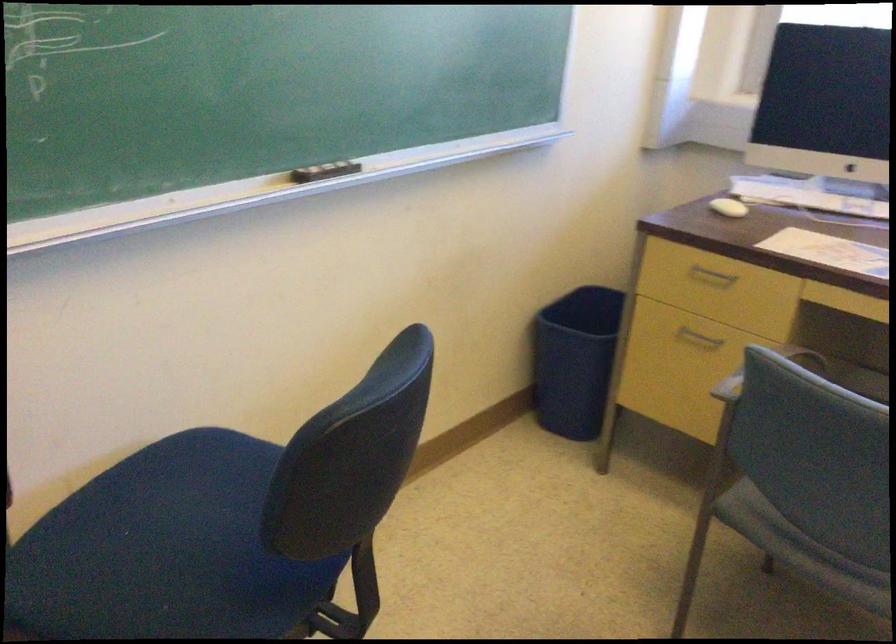
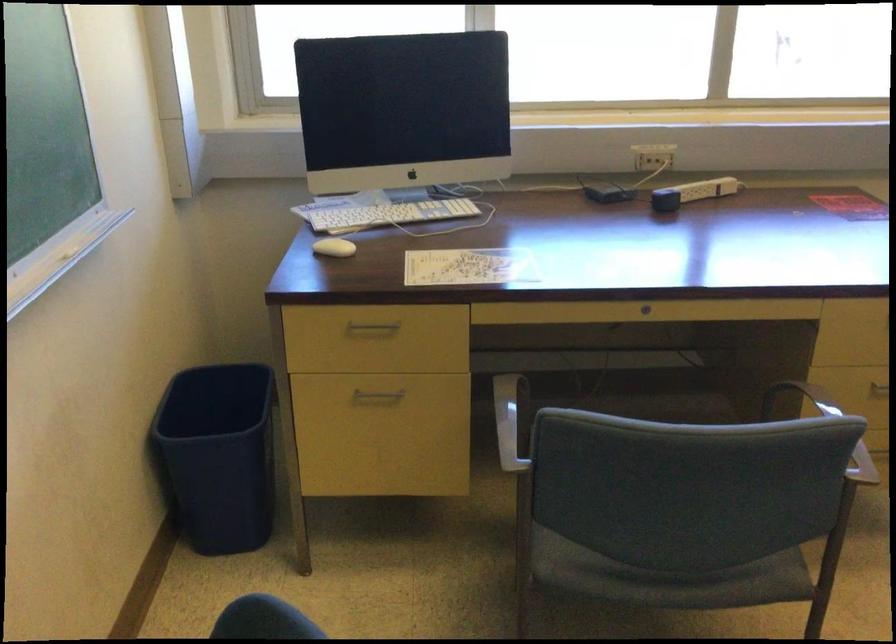
The point at (705,336) is marked in the first image. Where is the corresponding point in the second image?

(376, 395)